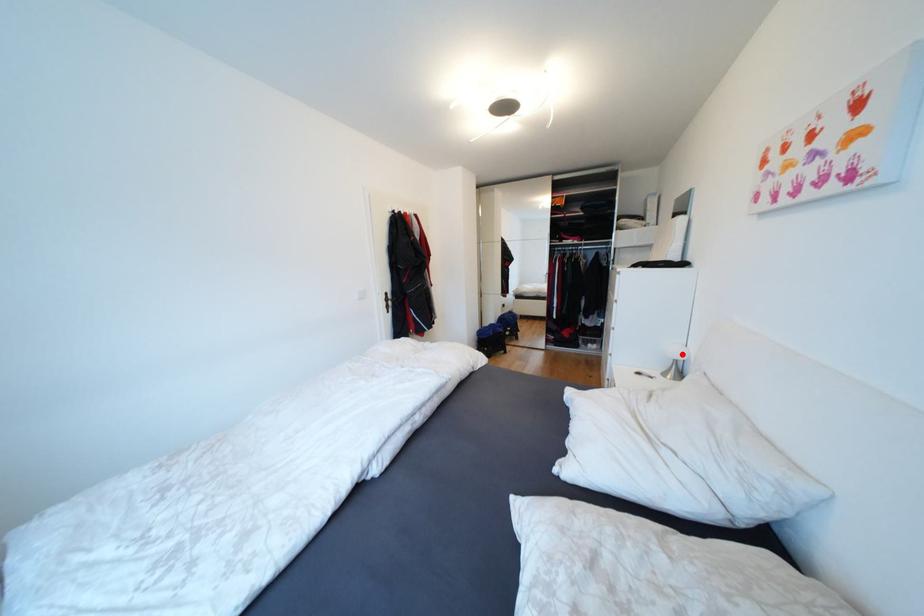
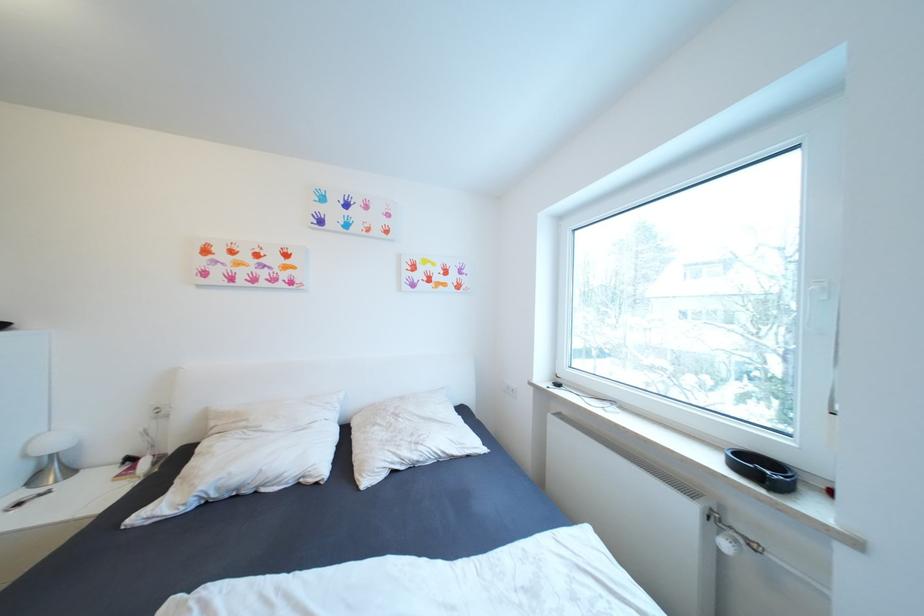
Where in the second image is the point corresponding to the highlighted location from the first image?

(63, 445)